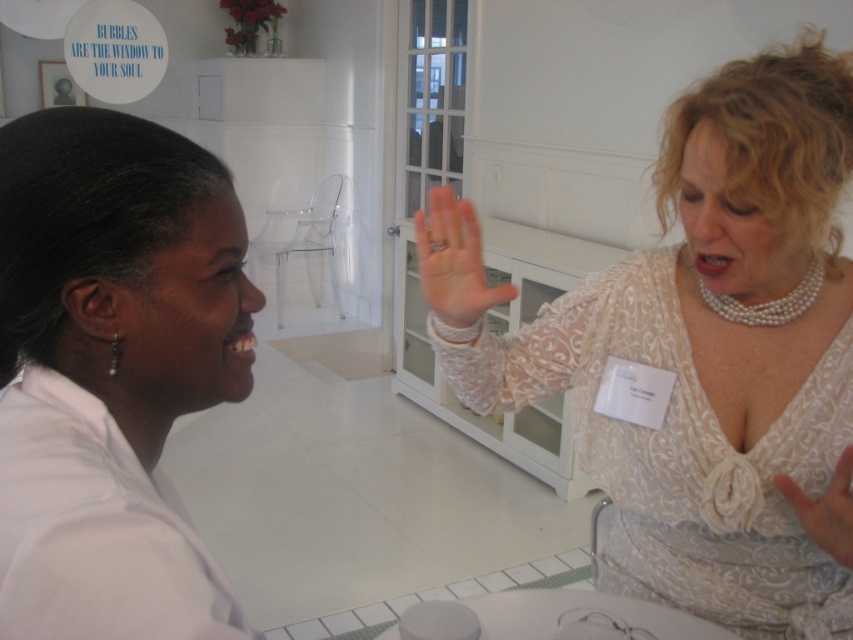
Question: Among these points, which one is nearest to the camera?

Choices:
 (A) (840, 541)
 (B) (473, 336)
 (C) (115, 332)
 (D) (479, 282)

Answer: (C)

Question: In this image, where is pink flesh-toned hand at center located relative to pearl necklace at upper right?

Choices:
 (A) below
 (B) above

Answer: (B)

Question: Which object is positioned farthest from the white lace dress at upper right?

Choices:
 (A) white lace hand at upper right
 (B) pearl necklace at upper right

Answer: (A)

Question: Can you confirm if pink flesh-toned hand at center is positioned below white lace hand at upper right?

Choices:
 (A) yes
 (B) no

Answer: (B)

Question: Considering the real-world distances, which object is farthest from the pearl necklace at upper right?

Choices:
 (A) white matte lab coat at left
 (B) pearl earring at left
 (C) pink flesh-toned hand at center
 (D) white lace dress at upper right

Answer: (B)

Question: Can you confirm if white matte lab coat at left is wider than white lace hand at upper right?

Choices:
 (A) yes
 (B) no

Answer: (A)